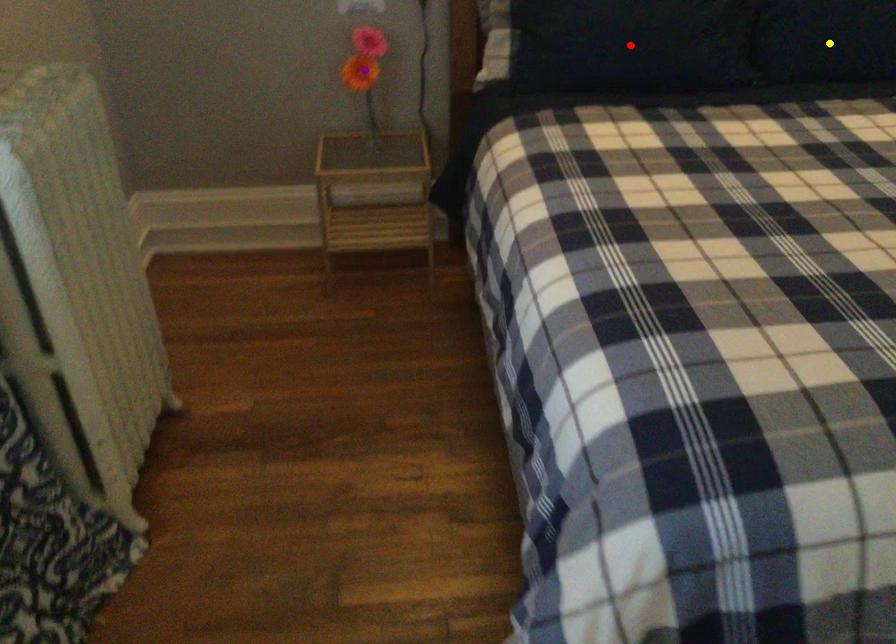
Order these from nearest to farthest:
yellow point
purple point
red point

1. yellow point
2. red point
3. purple point